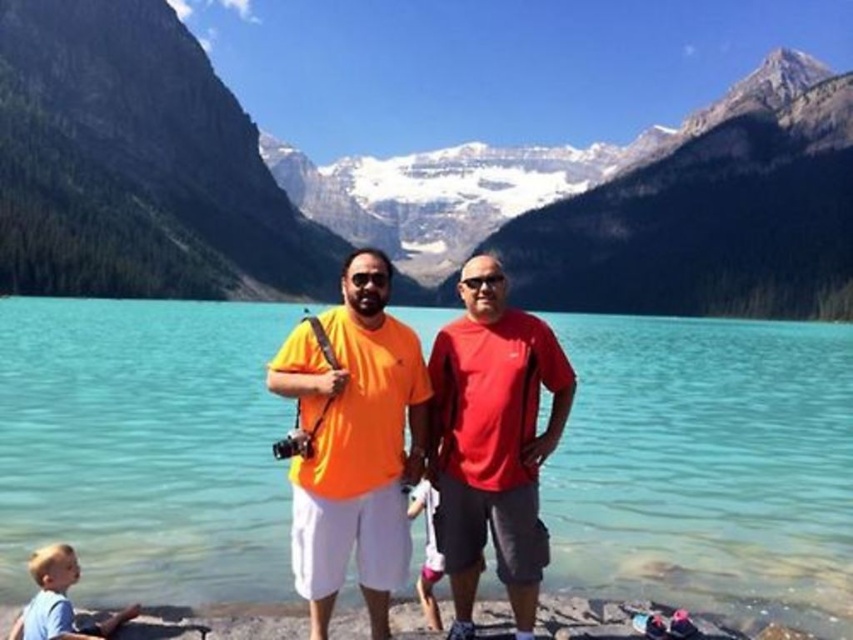
Does snowy granite mountain at upper center appear on the right side of matte red t-shirt at center?

Correct, you'll find snowy granite mountain at upper center to the right of matte red t-shirt at center.

Does snowy granite mountain at upper center lie in front of matte red t-shirt at center?

No, snowy granite mountain at upper center is further to the viewer.

Is point (743, 141) positioned in front of point (439, 432)?

No, it is behind (439, 432).

Identify the location of snowy granite mountain at upper center. (137, 164).

Can you confirm if blue cotton shirt at lower left is thinner than white cotton shirt at center?

No, blue cotton shirt at lower left is not thinner than white cotton shirt at center.

Where is `blue cotton shirt at lower left`? Image resolution: width=853 pixels, height=640 pixels. blue cotton shirt at lower left is located at coordinates (59, 600).

Find the location of a particular element. This screenshot has height=640, width=853. blue cotton shirt at lower left is located at coordinates (59, 600).

Does clear blue water at center appear over orange cotton t-shirt at center?

Yes.

Which is in front, point (601, 589) or point (291, 332)?

Point (601, 589) is more forward.

The height and width of the screenshot is (640, 853). I want to click on clear blue water at center, so click(x=706, y=467).